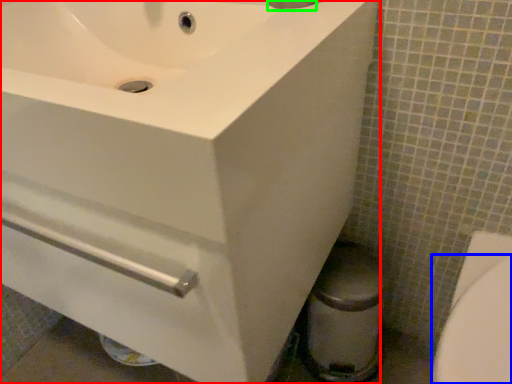
Question: Based on their relative distances, which object is nearer to sink (highlighted by a red box)? Choose from bidet (highlighted by a blue box) and plumbing fixture (highlighted by a green box).

Choices:
 (A) bidet
 (B) plumbing fixture

Answer: (B)